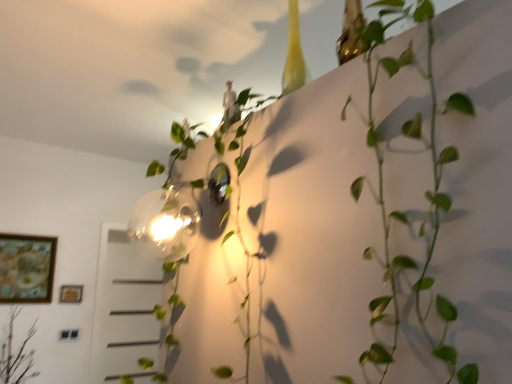
The width and height of the screenshot is (512, 384). Describe the element at coordinates (71, 294) in the screenshot. I see `gold metallic picture frame at lower left, which is the 2th picture frame in left-to-right order` at that location.

Describe the element at coordinates (402, 212) in the screenshot. I see `green matte plant at upper right, marked as the 3th plant in a left-to-right arrangement` at that location.

Locate an element on the screen. This screenshot has width=512, height=384. wooden framed artwork at lower left, which is counted as the first picture frame, starting from the left is located at coordinates (26, 268).

Is the surface of green leafy plant at upper center, the 2th plant positioned from the front, in direct contact with wooden framed artwork at lower left, placed as the 2th picture frame when sorted from right to left?

No, green leafy plant at upper center, the 2th plant positioned from the front, is not touching wooden framed artwork at lower left, placed as the 2th picture frame when sorted from right to left.

From a real-world perspective, relative to wooden framed artwork at lower left, placed as the 2th picture frame when sorted from right to left, is green leafy plant at upper center, the second plant positioned from the right, vertically above or below?

Result: green leafy plant at upper center, the second plant positioned from the right, is situated higher than wooden framed artwork at lower left, placed as the 2th picture frame when sorted from right to left, in the real world.

From the image's perspective, which one is positioned higher, green leafy plant at upper center, the 2th plant positioned from the left, or wooden framed artwork at lower left, which is counted as the first picture frame, starting from the left?

green leafy plant at upper center, the 2th plant positioned from the left, from the image's perspective.

This screenshot has width=512, height=384. In order to click on picture frame that is the 2nd object directly below the green leafy plant at upper center, the second plant positioned from the right (from a real-world perspective) in this screenshot , I will do click(71, 294).

Considering the relative sizes of green leafy plant at upper center, marked as the second plant in a back-to-front arrangement, and gold metallic picture frame at lower left, which is the 2th picture frame in left-to-right order, in the image provided, is green leafy plant at upper center, marked as the second plant in a back-to-front arrangement, taller than gold metallic picture frame at lower left, which is the 2th picture frame in left-to-right order,?

Indeed, green leafy plant at upper center, marked as the second plant in a back-to-front arrangement, has a greater height compared to gold metallic picture frame at lower left, which is the 2th picture frame in left-to-right order.

Could gold metallic picture frame at lower left, which is the 2th picture frame in left-to-right order, be considered to be inside green leafy plant at upper center, the 2th plant positioned from the front?

No, green leafy plant at upper center, the 2th plant positioned from the front, does not contain gold metallic picture frame at lower left, which is the 2th picture frame in left-to-right order.

Can we say gold metallic picture frame at lower left, which is the 2th picture frame in left-to-right order, lies outside green leafy plant at upper center, the 2th plant positioned from the left?

Yes.

From the image's perspective, which is below, gold metallic picture frame at lower left, marked as the 1th picture frame in a right-to-left arrangement, or green leafy plant at upper center, the 2th plant positioned from the left?

gold metallic picture frame at lower left, marked as the 1th picture frame in a right-to-left arrangement, is shown below in the image.

Consider the image. Is the surface of gold metallic picture frame at lower left, which is the 2th picture frame in left-to-right order, in direct contact with green leafy plant at upper center, marked as the second plant in a back-to-front arrangement?

No.

Between wooden framed artwork at lower left, placed as the 2th picture frame when sorted from right to left, and green leafy plant at upper center, the 2th plant positioned from the left, which one has smaller width?

wooden framed artwork at lower left, placed as the 2th picture frame when sorted from right to left, is thinner.

Consider the image. Which is farther from the camera, (14, 288) or (206, 216)?

The point (14, 288) is more distant.

Which object is positioned more to the left, wooden framed artwork at lower left, which is counted as the first picture frame, starting from the left, or green leafy plant at upper center, marked as the second plant in a back-to-front arrangement?

From the viewer's perspective, wooden framed artwork at lower left, which is counted as the first picture frame, starting from the left, appears more on the left side.

How many degrees apart are the facing directions of wooden framed artwork at lower left, placed as the 2th picture frame when sorted from right to left, and green leafy plant at upper center, the second plant positioned from the right?

They differ by 90 degrees in their facing directions.

How many degrees apart are the facing directions of green matte plant at upper right, marked as the 3th plant in a left-to-right arrangement, and green leafy plant at upper center, the 2th plant positioned from the front?

They differ by 0.00116 degrees in their facing directions.

Is green matte plant at upper right, which ranks as the 3th plant in back-to-front order, beside green leafy plant at upper center, marked as the second plant in a back-to-front arrangement?

There is a gap between green matte plant at upper right, which ranks as the 3th plant in back-to-front order, and green leafy plant at upper center, marked as the second plant in a back-to-front arrangement.

Is green matte plant at upper right, the first plant from the right, behind green leafy plant at upper center, the 2th plant positioned from the front?

No, green matte plant at upper right, the first plant from the right, is closer to the camera.

Who is bigger, green matte plant at upper right, marked as the 3th plant in a left-to-right arrangement, or green leafy plant at upper center, the 2th plant positioned from the front?

green leafy plant at upper center, the 2th plant positioned from the front, is bigger.

Could you tell me if gold metallic picture frame at lower left, marked as the 1th picture frame in a right-to-left arrangement, is facing wooden framed artwork at lower left, which is counted as the first picture frame, starting from the left?

No, gold metallic picture frame at lower left, marked as the 1th picture frame in a right-to-left arrangement, is not aimed at wooden framed artwork at lower left, which is counted as the first picture frame, starting from the left.

Would you say gold metallic picture frame at lower left, marked as the 1th picture frame in a right-to-left arrangement, contains wooden framed artwork at lower left, placed as the 2th picture frame when sorted from right to left?

No, wooden framed artwork at lower left, placed as the 2th picture frame when sorted from right to left, is not a part of gold metallic picture frame at lower left, marked as the 1th picture frame in a right-to-left arrangement.

Is point (76, 301) closer to camera compared to point (49, 261)?

No, it is behind (49, 261).

In order to click on picture frame behind the wooden framed artwork at lower left, placed as the 2th picture frame when sorted from right to left in this screenshot , I will do `click(71, 294)`.

Is green matte plant at lower left, which is the 1th plant in left-to-right order, with green matte plant at upper right, which ranks as the 3th plant in back-to-front order?

No.

Which object is closer to the camera taking this photo, green matte plant at lower left, which is the 1th plant in back-to-front order, or green matte plant at upper right, the first plant from the right?

green matte plant at upper right, the first plant from the right, is in front.

Choose the correct answer: Is green matte plant at lower left, which is the 1th plant in left-to-right order, inside green matte plant at upper right, which ranks as the 3th plant in back-to-front order, or outside it?

green matte plant at lower left, which is the 1th plant in left-to-right order, is not inside green matte plant at upper right, which ranks as the 3th plant in back-to-front order, it's outside.

Is green matte plant at lower left, the 3th plant from the right, facing towards green matte plant at upper right, which ranks as the 3th plant in back-to-front order?

Yes, green matte plant at lower left, the 3th plant from the right, is oriented towards green matte plant at upper right, which ranks as the 3th plant in back-to-front order.

You are a GUI agent. You are given a task and a screenshot of the screen. Output one action in this format:
    pyautogui.click(x=<x>, y=<y>)
    Task: Click on the 2nd plant counting from the right of the wooden framed artwork at lower left, which is counted as the first picture frame, starting from the left
    This screenshot has width=512, height=384.
    Given the screenshot: What is the action you would take?
    pyautogui.click(x=194, y=237)

Identify the location of the 2nd plant in front of the gold metallic picture frame at lower left, which is the 2th picture frame in left-to-right order, starting your count from the anchor. Image resolution: width=512 pixels, height=384 pixels. (194, 237).

Based on the photo, looking at the image, which one is located closer to green leafy plant at upper center, the second plant positioned from the right, green matte plant at upper right, the first plant viewed from the front, or wooden framed artwork at lower left, which is counted as the first picture frame, starting from the left?

green matte plant at upper right, the first plant viewed from the front.

Which object lies nearer to the anchor point green leafy plant at upper center, the second plant positioned from the right, wooden framed artwork at lower left, placed as the 2th picture frame when sorted from right to left, or green matte plant at lower left, which is the 1th plant in left-to-right order?

wooden framed artwork at lower left, placed as the 2th picture frame when sorted from right to left.

Considering their positions, is gold metallic picture frame at lower left, which is the 2th picture frame in left-to-right order, positioned closer to wooden framed artwork at lower left, placed as the 2th picture frame when sorted from right to left, than green matte plant at lower left, which is the 1th plant in left-to-right order?

gold metallic picture frame at lower left, which is the 2th picture frame in left-to-right order, is closer to wooden framed artwork at lower left, placed as the 2th picture frame when sorted from right to left.

When comparing their distances from green leafy plant at upper center, the 2th plant positioned from the left, does green matte plant at lower left, the 3th plant from the right, or wooden framed artwork at lower left, placed as the 2th picture frame when sorted from right to left, seem further?

green matte plant at lower left, the 3th plant from the right, is positioned further to the anchor green leafy plant at upper center, the 2th plant positioned from the left.

From the image, which object appears to be farther from wooden framed artwork at lower left, placed as the 2th picture frame when sorted from right to left, gold metallic picture frame at lower left, which is the 2th picture frame in left-to-right order, or green leafy plant at upper center, the 2th plant positioned from the front?

Among the two, green leafy plant at upper center, the 2th plant positioned from the front, is located further to wooden framed artwork at lower left, placed as the 2th picture frame when sorted from right to left.

Based on their spatial positions, is green matte plant at lower left, which is the 1th plant in back-to-front order, or gold metallic picture frame at lower left, which is the 2th picture frame in left-to-right order, further from wooden framed artwork at lower left, placed as the 2th picture frame when sorted from right to left?

green matte plant at lower left, which is the 1th plant in back-to-front order.

Looking at the image, which one is located closer to green leafy plant at upper center, the second plant positioned from the right, green matte plant at upper right, marked as the 3th plant in a left-to-right arrangement, or gold metallic picture frame at lower left, which is the 2th picture frame in left-to-right order?

green matte plant at upper right, marked as the 3th plant in a left-to-right arrangement, is closer to green leafy plant at upper center, the second plant positioned from the right.

When comparing their distances from gold metallic picture frame at lower left, which is the 2th picture frame in left-to-right order, does green matte plant at upper right, the first plant viewed from the front, or wooden framed artwork at lower left, which is counted as the first picture frame, starting from the left, seem further?

green matte plant at upper right, the first plant viewed from the front, lies further to gold metallic picture frame at lower left, which is the 2th picture frame in left-to-right order, than the other object.

Locate an element on the screen. picture frame between green matte plant at lower left, which is the 1th plant in back-to-front order, and gold metallic picture frame at lower left, which is the 2th picture frame in left-to-right order, along the z-axis is located at coordinates (26, 268).

Where is `plant between green matte plant at upper right, the first plant from the right, and green matte plant at lower left, the 3th plant from the right, along the z-axis`? plant between green matte plant at upper right, the first plant from the right, and green matte plant at lower left, the 3th plant from the right, along the z-axis is located at coordinates (194, 237).

You are a GUI agent. You are given a task and a screenshot of the screen. Output one action in this format:
    pyautogui.click(x=<x>, y=<y>)
    Task: Click on the plant between green leafy plant at upper center, the 2th plant positioned from the front, and wooden framed artwork at lower left, placed as the 2th picture frame when sorted from right to left, in the front-back direction
    
    Given the screenshot: What is the action you would take?
    pyautogui.click(x=16, y=355)

Image resolution: width=512 pixels, height=384 pixels. In order to click on picture frame between green leafy plant at upper center, the 2th plant positioned from the left, and gold metallic picture frame at lower left, which is the 2th picture frame in left-to-right order, along the z-axis in this screenshot , I will do `click(26, 268)`.